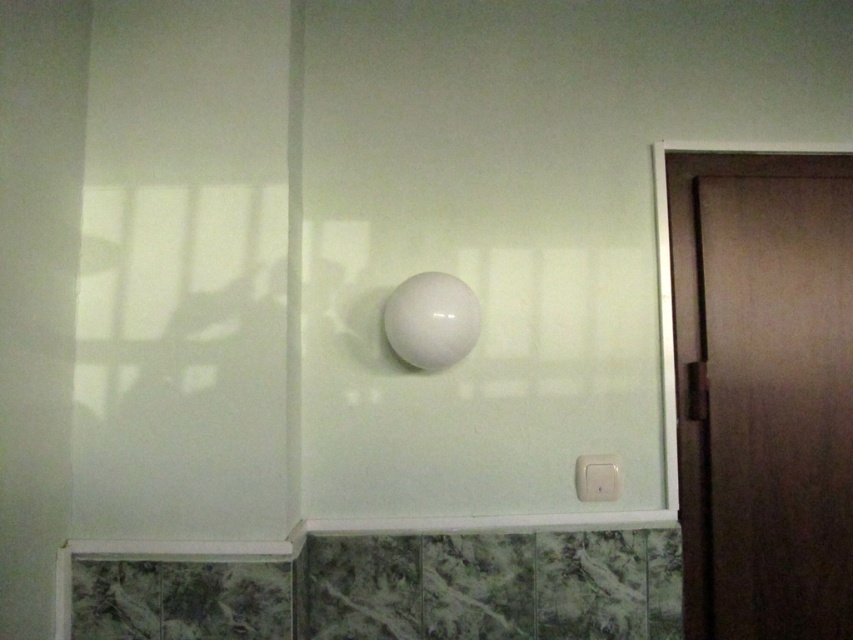
You are standing in a hallway and want to open the brown matte door at right. You notice there is a white plastic light switch at lower right. Which object is closer to you, the door or the light switch?

The brown matte door at right is closer to the viewer than the white plastic light switch at lower right, so the door is closer.

You are standing in front of the wall described. You notice a brown matte door at right located at point (762, 388). If you want to open the door, which direction should you turn from facing the wall?

The brown matte door at right is located at point (762, 388), which is on the right side of the wall. Therefore, you should turn to your right to face the door and open it.